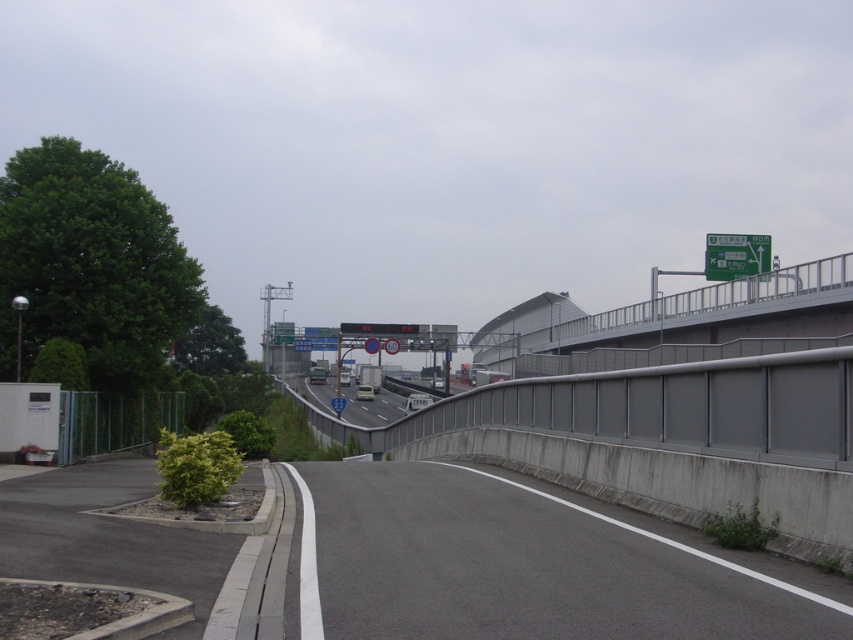
Question: Where is gray asphalt road at center located in relation to green plastic traffic sign at upper right in the image?

Choices:
 (A) left
 (B) right

Answer: (A)

Question: Can you confirm if gray asphalt road at center is positioned below green plastic traffic sign at upper right?

Choices:
 (A) yes
 (B) no

Answer: (A)

Question: Is gray asphalt road at center below green plastic traffic sign at upper right?

Choices:
 (A) yes
 (B) no

Answer: (A)